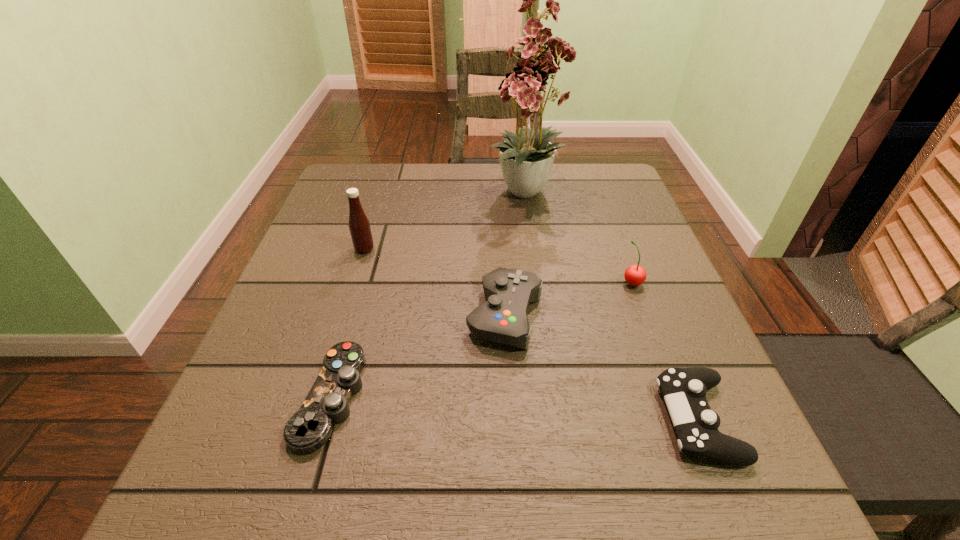
Locate an element on the screen. The width and height of the screenshot is (960, 540). object at the near edge is located at coordinates (684, 390).

This screenshot has width=960, height=540. In order to click on Tabasco sauce that is at the left edge in this screenshot , I will do `click(359, 225)`.

This screenshot has width=960, height=540. What are the coordinates of `control that is positioned at the left edge` in the screenshot? It's located at (308, 429).

Where is `cherry situated at the right edge`? cherry situated at the right edge is located at coordinates (635, 275).

Identify the location of control that is at the right edge. (684, 390).

Where is `object positioned at the near right corner`? The image size is (960, 540). object positioned at the near right corner is located at coordinates (684, 390).

The image size is (960, 540). Identify the location of vacant space at the far edge. (427, 172).

Image resolution: width=960 pixels, height=540 pixels. Identify the location of vacant space at the near edge of the desktop. (577, 463).

Image resolution: width=960 pixels, height=540 pixels. Identify the location of vacant space at the left edge. (296, 454).

What are the coordinates of `free space at the right edge of the desktop` in the screenshot? It's located at (721, 372).